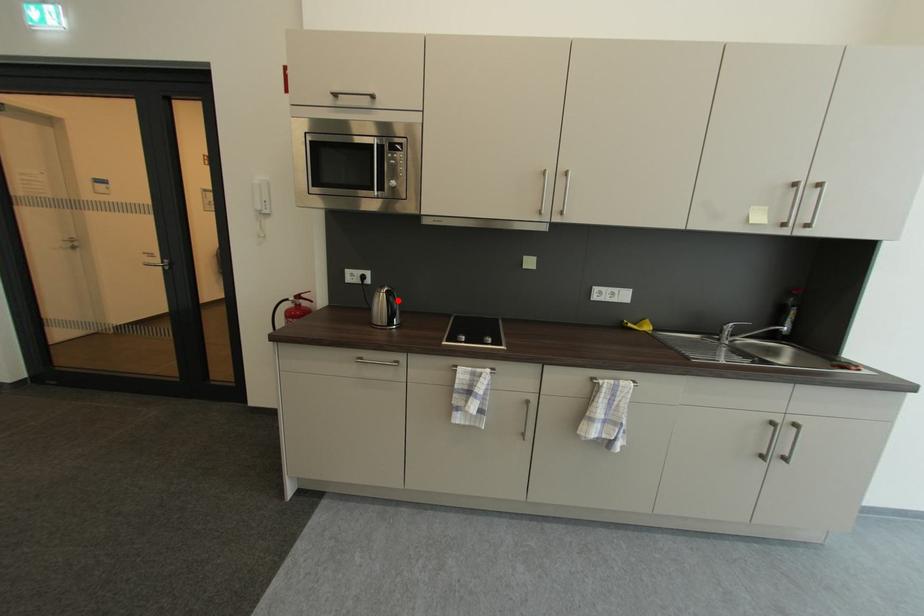
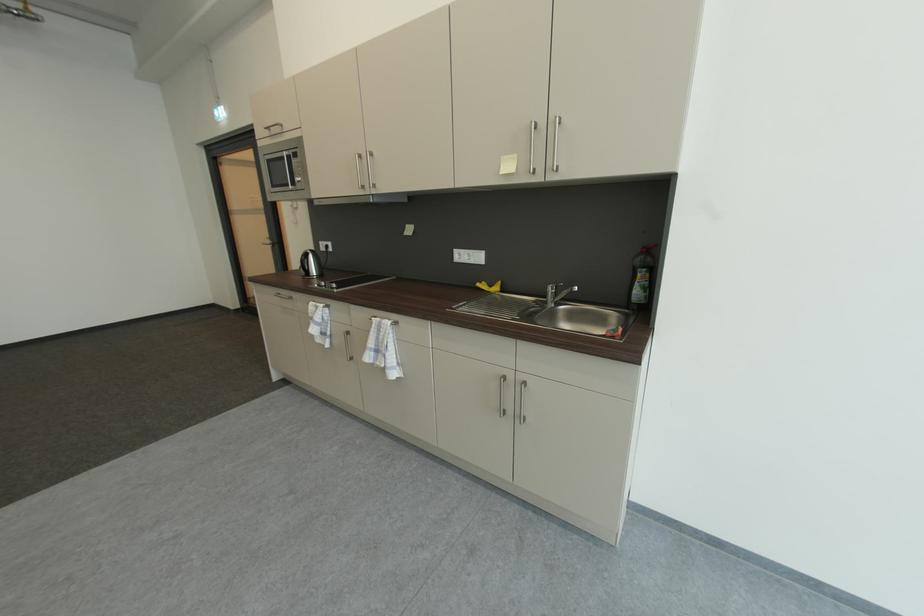
In the second image, find the point that corresponds to the highlighted location in the first image.

(310, 259)